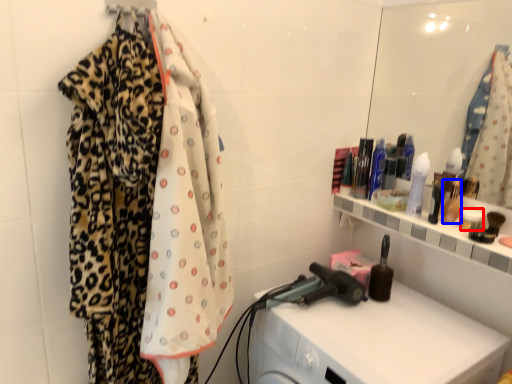
Question: Which point is further to the camera, toiletry (highlighted by a red box) or toiletry (highlighted by a blue box)?

Choices:
 (A) toiletry
 (B) toiletry

Answer: (B)